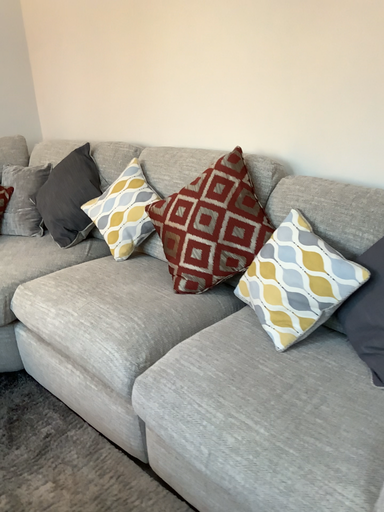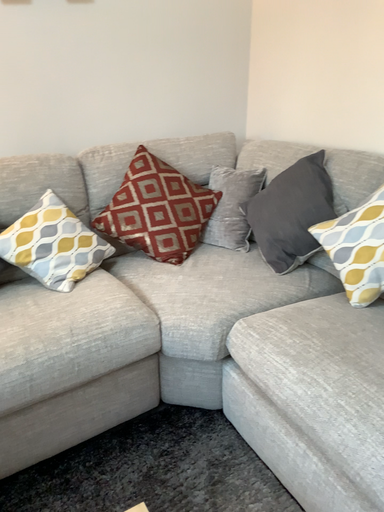
Question: How did the camera likely rotate when shooting the video?

Choices:
 (A) rotated left
 (B) rotated right

Answer: (A)